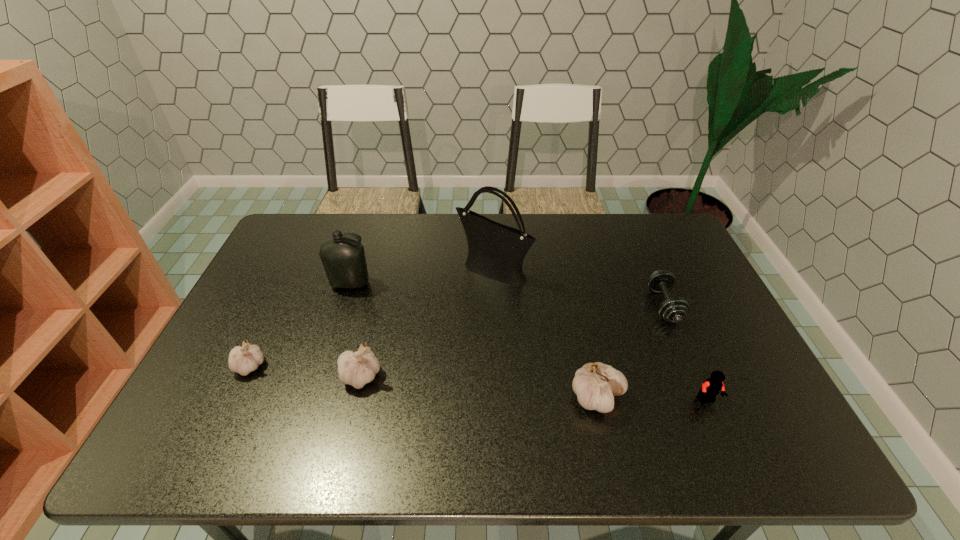
Image resolution: width=960 pixels, height=540 pixels. I want to click on location for an additional garlic to make spacing equal, so click(476, 387).